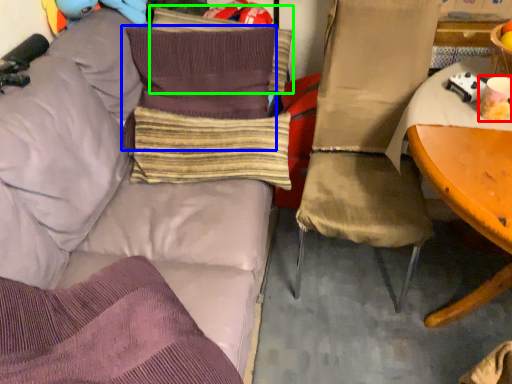
Question: Based on their relative distances, which object is farther from coffee cup (highlighted by a red box)? Choose from pillow (highlighted by a blue box) and pillow (highlighted by a green box).

Choices:
 (A) pillow
 (B) pillow

Answer: (B)